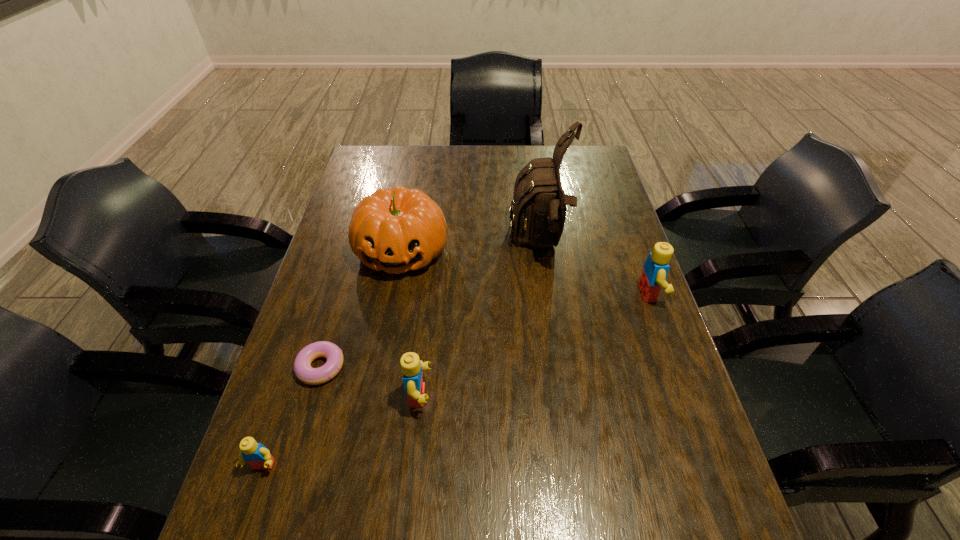
This screenshot has width=960, height=540. In order to click on vacant space located on the front-facing side of the fourth tallest object in this screenshot , I will do `click(486, 396)`.

I want to click on vacant space situated on the front-facing side of the tallest object, so click(x=410, y=245).

Identify the location of vacant space located 0.110m on the front-facing side of the tallest object. This screenshot has width=960, height=540. (473, 245).

The height and width of the screenshot is (540, 960). Find the location of `free spot located 0.320m on the front-facing side of the tallest object`. free spot located 0.320m on the front-facing side of the tallest object is located at coordinates (403, 245).

You are a GUI agent. You are given a task and a screenshot of the screen. Output one action in this format:
    pyautogui.click(x=<x>, y=<y>)
    Task: Click on the vacant space situated 0.250m on the carved face of the pumpkin
    
    Given the screenshot: What is the action you would take?
    pyautogui.click(x=381, y=361)

Where is `vacant space located 0.090m on the front of the doughnut`? The width and height of the screenshot is (960, 540). vacant space located 0.090m on the front of the doughnut is located at coordinates (303, 426).

Identify the location of object that is at the near edge. Image resolution: width=960 pixels, height=540 pixels. (257, 455).

Where is `Lego at the left edge`? Image resolution: width=960 pixels, height=540 pixels. Lego at the left edge is located at coordinates (257, 455).

Where is `pumpkin positioned at the left edge`? pumpkin positioned at the left edge is located at coordinates (401, 229).

This screenshot has height=540, width=960. What are the coordinates of `doughnut at the left edge` in the screenshot? It's located at (x=304, y=372).